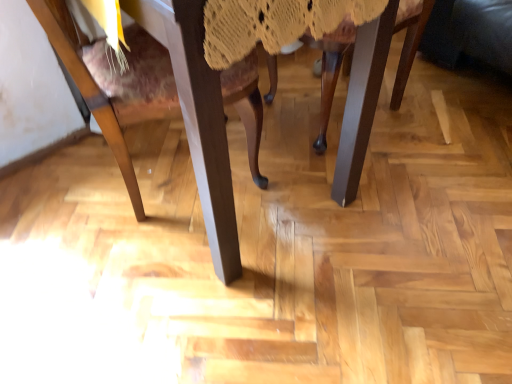
What is the approximate height of wooden chair at center, the second chair positioned from the right?

wooden chair at center, the second chair positioned from the right, is 26.31 inches tall.

Locate an element on the screen. wooden chair at center, the 1th chair when ordered from left to right is located at coordinates (205, 116).

What do you see at coordinates (205, 116) in the screenshot? I see `wooden chair at center, the 1th chair when ordered from left to right` at bounding box center [205, 116].

The image size is (512, 384). What do you see at coordinates (330, 70) in the screenshot?
I see `wooden chair leg at center, the second chair positioned from the left` at bounding box center [330, 70].

This screenshot has width=512, height=384. Find the location of `wooden chair leg at center, which appears as the 1th chair when viewed from the right`. wooden chair leg at center, which appears as the 1th chair when viewed from the right is located at coordinates (330, 70).

Find the location of a particular element. This screenshot has width=512, height=384. wooden chair at center, the 1th chair when ordered from left to right is located at coordinates [205, 116].

Which object is positioned more to the right, wooden chair at center, the 1th chair when ordered from left to right, or wooden chair leg at center, the second chair positioned from the left?

wooden chair leg at center, the second chair positioned from the left.

Is wooden chair at center, the second chair positioned from the right, further to the viewer compared to wooden chair leg at center, which appears as the 1th chair when viewed from the right?

No, it is in front of wooden chair leg at center, which appears as the 1th chair when viewed from the right.

Considering the points (113, 125) and (325, 108), which point is in front, point (113, 125) or point (325, 108)?

The point (113, 125) is closer.

From the image's perspective, is wooden chair at center, the second chair positioned from the right, located above or below wooden chair leg at center, which appears as the 1th chair when viewed from the right?

wooden chair at center, the second chair positioned from the right, is situated lower than wooden chair leg at center, which appears as the 1th chair when viewed from the right, in the image.

From a real-world perspective, between wooden chair at center, the second chair positioned from the right, and wooden chair leg at center, the second chair positioned from the left, who is vertically lower?

wooden chair leg at center, the second chair positioned from the left, from a real-world perspective.

Between wooden chair at center, the 1th chair when ordered from left to right, and wooden chair leg at center, which appears as the 1th chair when viewed from the right, which one has smaller width?

Thinner between the two is wooden chair leg at center, which appears as the 1th chair when viewed from the right.

Which of these two, wooden chair at center, the 1th chair when ordered from left to right, or wooden chair leg at center, the second chair positioned from the left, stands taller?

Standing taller between the two is wooden chair at center, the 1th chair when ordered from left to right.

Based on their sizes in the image, would you say wooden chair at center, the second chair positioned from the right, is bigger or smaller than wooden chair leg at center, which appears as the 1th chair when viewed from the right?

Clearly, wooden chair at center, the second chair positioned from the right, is larger in size than wooden chair leg at center, which appears as the 1th chair when viewed from the right.

Is wooden chair at center, the 1th chair when ordered from left to right, completely or partially outside of wooden chair leg at center, which appears as the 1th chair when viewed from the right?

Yes, wooden chair at center, the 1th chair when ordered from left to right, is located beyond the bounds of wooden chair leg at center, which appears as the 1th chair when viewed from the right.

Is wooden chair at center, the second chair positioned from the right, placed right next to wooden chair leg at center, which appears as the 1th chair when viewed from the right?

No, wooden chair at center, the second chair positioned from the right, is not with wooden chair leg at center, which appears as the 1th chair when viewed from the right.

Is wooden chair at center, the 1th chair when ordered from left to right, oriented towards wooden chair leg at center, which appears as the 1th chair when viewed from the right?

Yes.

Find the location of a particular element. chair on the right side of wooden chair at center, the second chair positioned from the right is located at coordinates (330, 70).

Between wooden chair leg at center, which appears as the 1th chair when viewed from the right, and wooden chair at center, the 1th chair when ordered from left to right, which one appears on the left side from the viewer's perspective?

wooden chair at center, the 1th chair when ordered from left to right.

Is wooden chair leg at center, the second chair positioned from the left, positioned behind wooden chair at center, the second chair positioned from the right?

Yes, the depth of wooden chair leg at center, the second chair positioned from the left, is greater than that of wooden chair at center, the second chair positioned from the right.

Which point is more forward, (267, 59) or (241, 91)?

The point (241, 91) is closer.

From the image's perspective, would you say wooden chair leg at center, which appears as the 1th chair when viewed from the right, is positioned over wooden chair at center, the second chair positioned from the right?

Correct, wooden chair leg at center, which appears as the 1th chair when viewed from the right, appears higher than wooden chair at center, the second chair positioned from the right, in the image.

From a real-world perspective, is wooden chair leg at center, the second chair positioned from the left, located higher than wooden chair at center, the second chair positioned from the right?

Incorrect, from a real-world perspective, wooden chair leg at center, the second chair positioned from the left, is lower than wooden chair at center, the second chair positioned from the right.

Can you confirm if wooden chair leg at center, the second chair positioned from the left, is thinner than wooden chair at center, the 1th chair when ordered from left to right?

Indeed, wooden chair leg at center, the second chair positioned from the left, has a lesser width compared to wooden chair at center, the 1th chair when ordered from left to right.

In the scene shown: Is wooden chair leg at center, which appears as the 1th chair when viewed from the right, taller than wooden chair at center, the second chair positioned from the right?

No.

Between wooden chair leg at center, which appears as the 1th chair when viewed from the right, and wooden chair at center, the second chair positioned from the right, which one has smaller size?

wooden chair leg at center, which appears as the 1th chair when viewed from the right.

Choose the correct answer: Is wooden chair leg at center, which appears as the 1th chair when viewed from the right, inside wooden chair at center, the 1th chair when ordered from left to right, or outside it?

The correct answer is: outside.

Are wooden chair leg at center, which appears as the 1th chair when viewed from the right, and wooden chair at center, the second chair positioned from the right, beside each other?

No, wooden chair leg at center, which appears as the 1th chair when viewed from the right, is not touching wooden chair at center, the second chair positioned from the right.

Is wooden chair leg at center, which appears as the 1th chair when viewed from the right, positioned with its back to wooden chair at center, the second chair positioned from the right?

That's not correct — wooden chair leg at center, which appears as the 1th chair when viewed from the right, is not looking away from wooden chair at center, the second chair positioned from the right.

Based on the photo, what's the angular difference between wooden chair leg at center, which appears as the 1th chair when viewed from the right, and wooden chair at center, the second chair positioned from the right,'s facing directions?

The facing directions of wooden chair leg at center, which appears as the 1th chair when viewed from the right, and wooden chair at center, the second chair positioned from the right, are 168 degrees apart.

The width and height of the screenshot is (512, 384). What are the coordinates of `chair on the right side of wooden chair at center, the 1th chair when ordered from left to right` in the screenshot? It's located at (330, 70).

Identify the location of chair that appears in front of the wooden chair leg at center, the second chair positioned from the left. This screenshot has width=512, height=384. (205, 116).

Where is `chair that appears below the wooden chair leg at center, the second chair positioned from the left (from the image's perspective)`? Image resolution: width=512 pixels, height=384 pixels. chair that appears below the wooden chair leg at center, the second chair positioned from the left (from the image's perspective) is located at coordinates (205, 116).